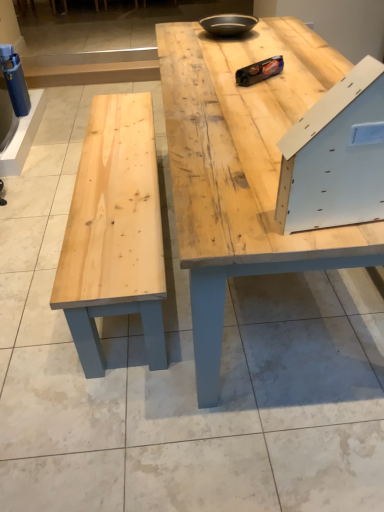
The height and width of the screenshot is (512, 384). What are the coordinates of `vacant area that is situated to the right of matte black bowl at upper center` in the screenshot? It's located at (288, 33).